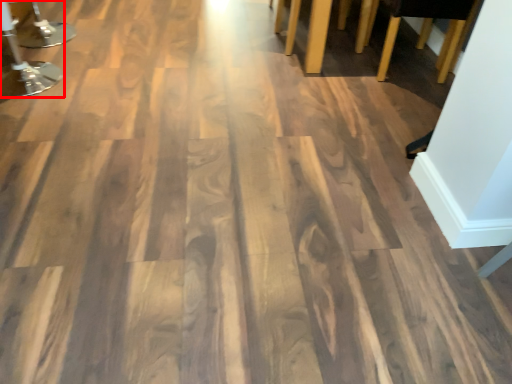
Question: Where is furniture (annotated by the red box) located in relation to furniture in the image?

Choices:
 (A) right
 (B) left

Answer: (B)